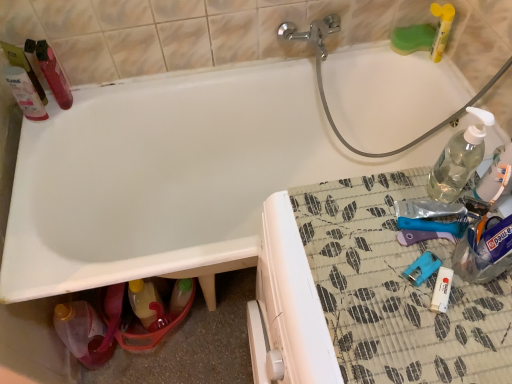
At what (x,y) coordinates should I click in order to perform the action: click on vacant area that lies to the right of translucent plastic bottle at upper left, arranged as the 1th bottle when viewed from the top. Please return your answer as a coordinate pair (x, y). Looking at the image, I should click on (108, 91).